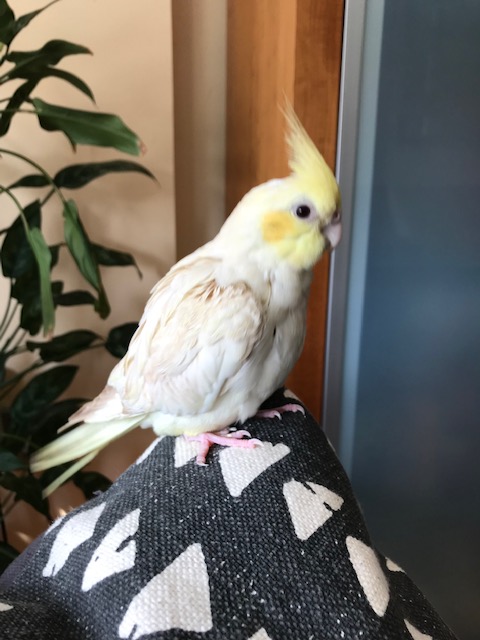
At what (x,y) coordinates should I click in order to perform the action: click on chest. Please return your answer as a coordinate pair (x, y). The image size is (480, 640). Looking at the image, I should click on (295, 332).